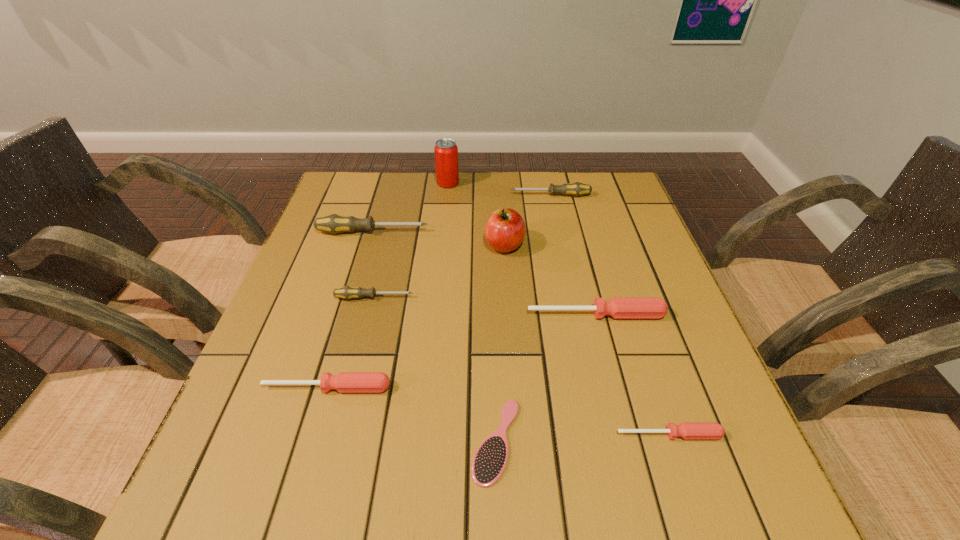
You are a GUI agent. You are given a task and a screenshot of the screen. Output one action in this format:
    pyautogui.click(x=<x>, y=<y>)
    Task: Click on the blank space that satisfies the following two spatial constraints: 1. on the back side of the sixth object from right to left; 2. on the right side of the second biggest red screwdriver
    
    Given the screenshot: What is the action you would take?
    pyautogui.click(x=387, y=183)

Find the location of a particular element. Image resolution: width=960 pixels, height=540 pixels. vacant area in the image that satisfies the following two spatial constraints: 1. on the front side of the red apple; 2. on the left side of the sixth object from right to left is located at coordinates (442, 245).

Locate an element on the screen. vacant position in the image that satisfies the following two spatial constraints: 1. at the tip of the shortest object; 2. on the left side of the second nearest gray screwdriver is located at coordinates tap(311, 441).

Image resolution: width=960 pixels, height=540 pixels. Identify the location of free location that satisfies the following two spatial constraints: 1. on the back side of the third nearest screwdriver; 2. at the tip of the rightmost gray screwdriver. (565, 195).

Locate an element on the screen. The width and height of the screenshot is (960, 540). vacant space that satisfies the following two spatial constraints: 1. at the tip of the fourth nearest object; 2. on the right side of the nearest gray screwdriver is located at coordinates (371, 315).